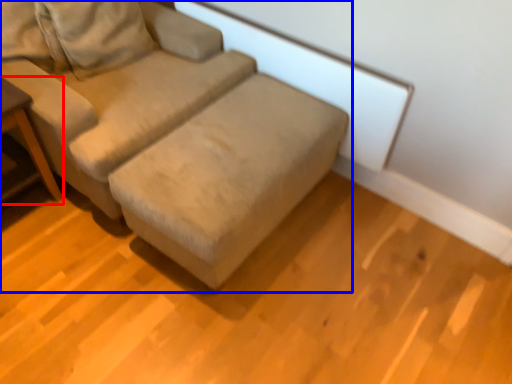
Question: Which point is further to the camera, table (highlighted by a red box) or studio couch (highlighted by a blue box)?

Choices:
 (A) table
 (B) studio couch

Answer: (A)